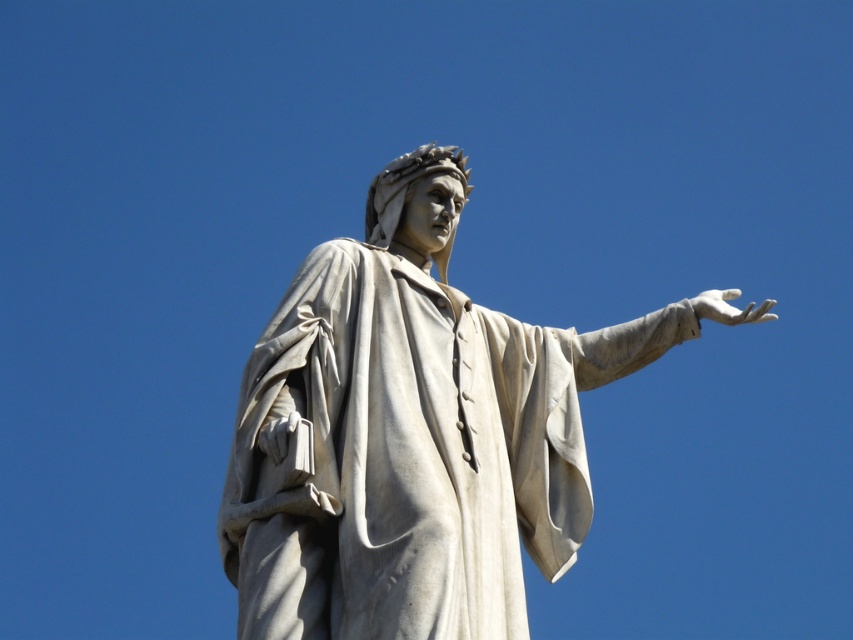
Question: Can you confirm if white marble statue at center is positioned above white marble hand at right?

Choices:
 (A) no
 (B) yes

Answer: (A)

Question: Does white marble statue at center have a lesser width compared to white marble hand at right?

Choices:
 (A) yes
 (B) no

Answer: (A)

Question: Which of the following is the farthest from the observer?

Choices:
 (A) (758, 312)
 (B) (419, 412)

Answer: (A)

Question: Which point appears closest to the camera in this image?

Choices:
 (A) (769, 308)
 (B) (495, 365)

Answer: (B)

Question: Is white marble statue at center below white marble hand at right?

Choices:
 (A) yes
 (B) no

Answer: (A)